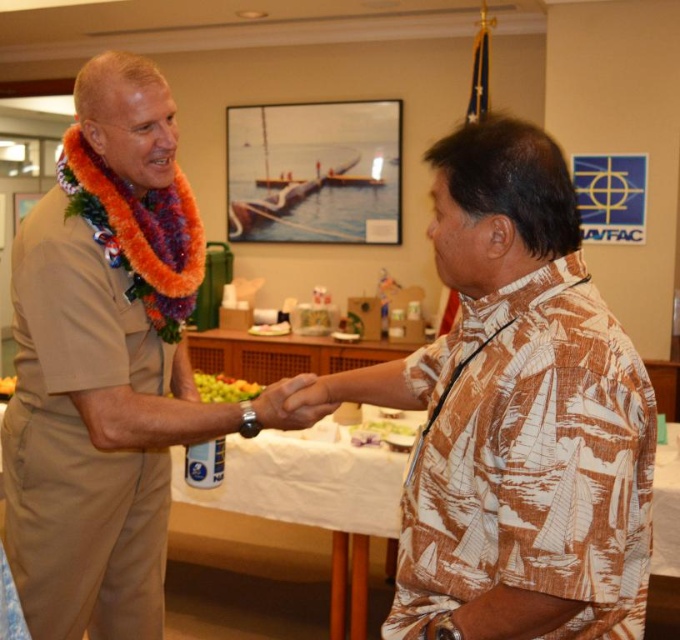
Is point (515, 342) positioned behind point (78, 259)?

That is False.

Does brown printed shirt at right have a smaller size compared to tan uniform at center?

Correct, brown printed shirt at right occupies less space than tan uniform at center.

Between point (551, 560) and point (171, 253), which one is positioned behind?

Point (171, 253)

At what (x,y) coordinates should I click in order to perform the action: click on brown printed shirt at right. Please return your answer as a coordinate pair (x, y). The width and height of the screenshot is (680, 640). Looking at the image, I should click on pyautogui.click(x=517, y=416).

Is point (163, 451) farther from viewer compared to point (262, 410)?

Yes, point (163, 451) is behind point (262, 410).

Who is more distant from viewer, (65, 248) or (289, 426)?

The point (289, 426) is behind.

Is point (194, 221) positioned in front of point (277, 419)?

That is False.

Image resolution: width=680 pixels, height=640 pixels. I want to click on tan uniform at center, so click(103, 364).

Does point (486, 388) lie behind point (318, 385)?

No.

Which is above, brown printed shirt at right or smooth skin hand at center?

brown printed shirt at right

Who is more distant from viewer, (x=394, y=628) or (x=316, y=416)?

Positioned behind is point (x=316, y=416).

You are a GUI agent. You are given a task and a screenshot of the screen. Output one action in this format:
    pyautogui.click(x=<x>, y=<y>)
    Task: Click on the brown printed shirt at right
    This screenshot has height=640, width=680.
    Given the screenshot: What is the action you would take?
    pyautogui.click(x=517, y=416)